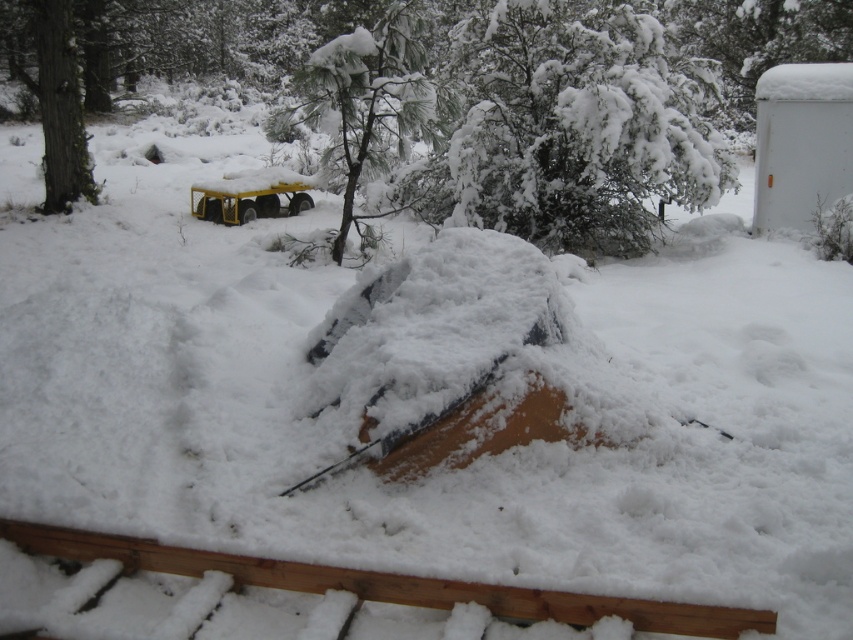
Question: Is snow-covered pine tree at center below smooth bark tree at upper left?

Choices:
 (A) no
 (B) yes

Answer: (B)

Question: Does white fluffy tree at upper center appear under snow-covered pine tree at center?

Choices:
 (A) no
 (B) yes

Answer: (A)

Question: Does white fluffy tree at upper center appear on the left side of snow-covered pine tree at center?

Choices:
 (A) yes
 (B) no

Answer: (B)

Question: Which point is closer to the camera?

Choices:
 (A) (560, 17)
 (B) (44, 180)

Answer: (A)

Question: Which point is farther to the camera?

Choices:
 (A) smooth bark tree at upper left
 (B) white fluffy tree at upper center
 (C) snow-covered pine tree at center

Answer: (A)

Question: Among these objects, which one is farthest from the camera?

Choices:
 (A) white fluffy tree at upper center
 (B) snow-covered pine tree at center
 (C) smooth bark tree at upper left

Answer: (C)